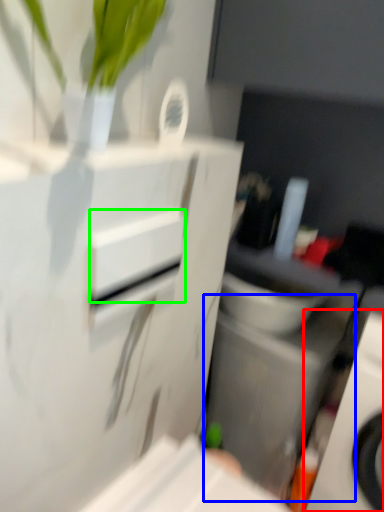
Question: Which is nearer to the home appliance (highlighted by a red box)? appliance (highlighted by a blue box) or drawer (highlighted by a green box).

Choices:
 (A) appliance
 (B) drawer

Answer: (A)